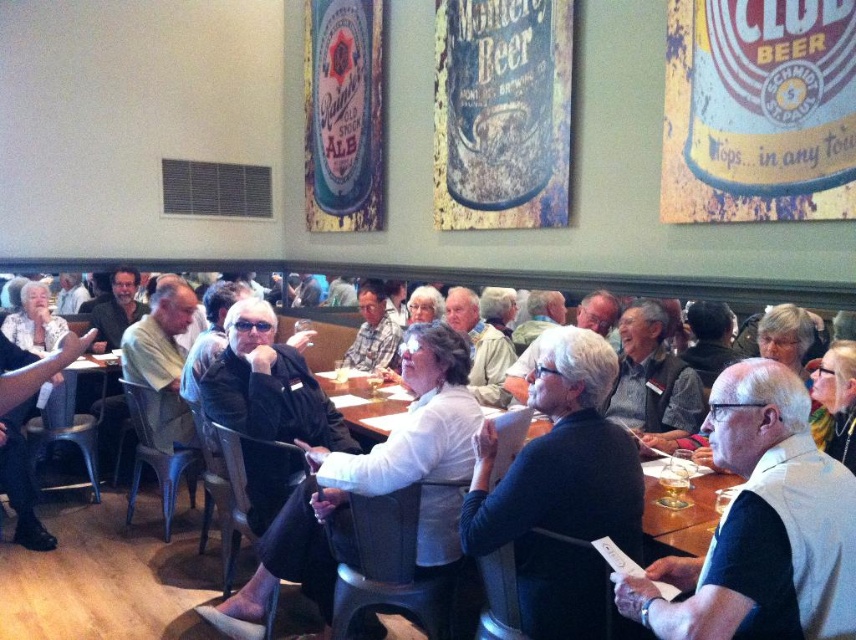
You are a photographer setting up a camera to capture both the white shirt at center and the black leather jacket at center. Since you want to ensure both are fully visible in the frame, which object should you position closer to the camera to accommodate their widths?

Since the white shirt at center might be wider than the black leather jacket at center, you should position the white shirt at center closer to the camera to ensure it fits within the frame.

You are standing at the entrance of the restaurant and notice a person wearing a black matte sweater at center. Can you determine the exact coordinates of where this person is sitting?

The black matte sweater at center is located at point (560,490), so the person is sitting at those coordinates.

You are standing in the restaurant and want to take a photo of both the point at position (x=318, y=374) and the point at position (x=319, y=516). Which point should you focus on first to ensure both are in focus?

You should focus on the point at position (x=319, y=516) first because it is closer to you than the point at position (x=318, y=374), which is further away. By focusing on the closer point, the further point will also be in focus due to the depth of field.